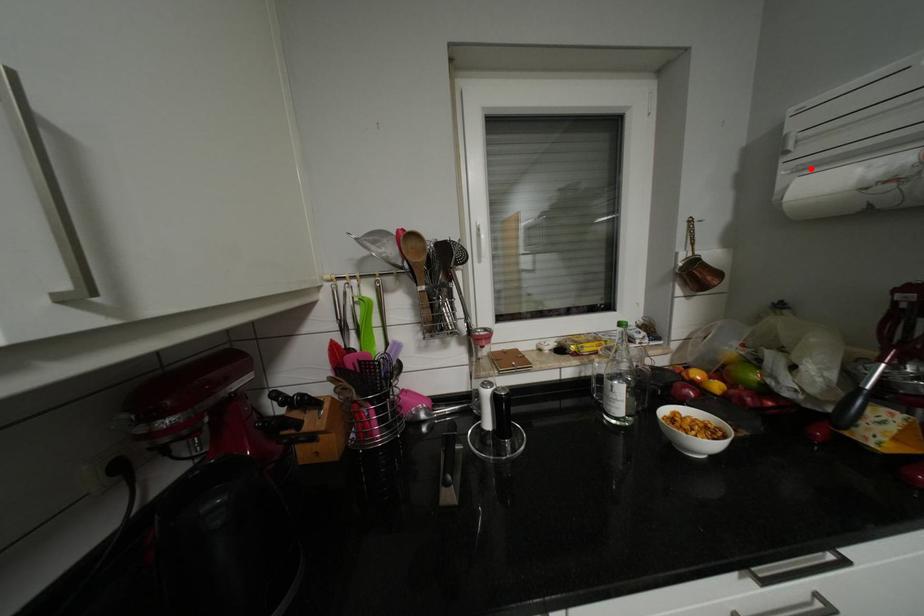
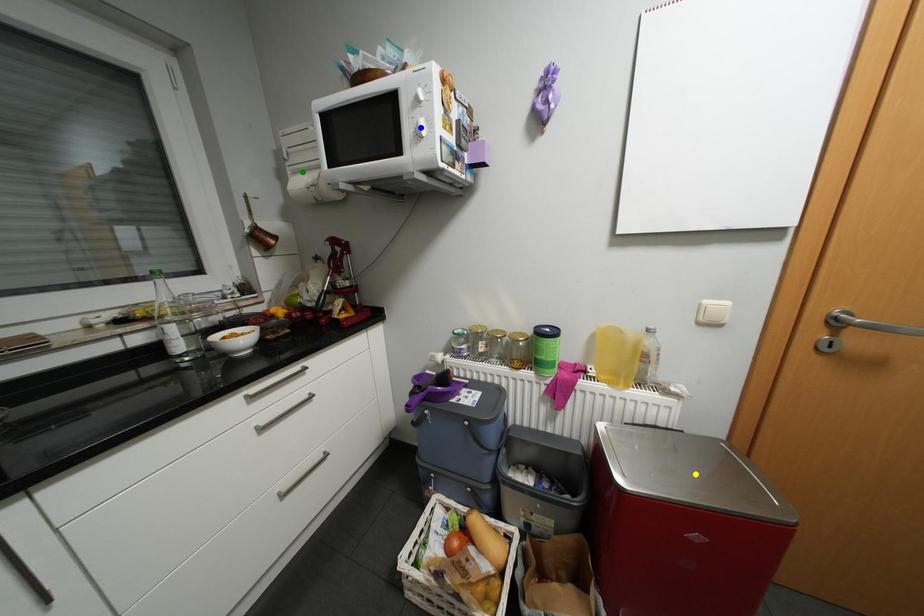
Question: I am providing you with two images of the same scene from different viewpoints. A red point is marked on the first image. You are given multiple points on the second image. Which point in image 2 is actually the same real-world point as the red point in image 1?

Choices:
 (A) blue point
 (B) green point
 (C) yellow point

Answer: (B)